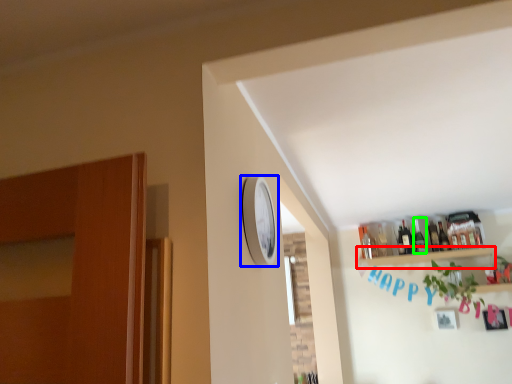
Question: Which is farther away from shelf (highlighted by a red box)? clock (highlighted by a blue box) or bottle (highlighted by a green box)?

Choices:
 (A) clock
 (B) bottle

Answer: (A)